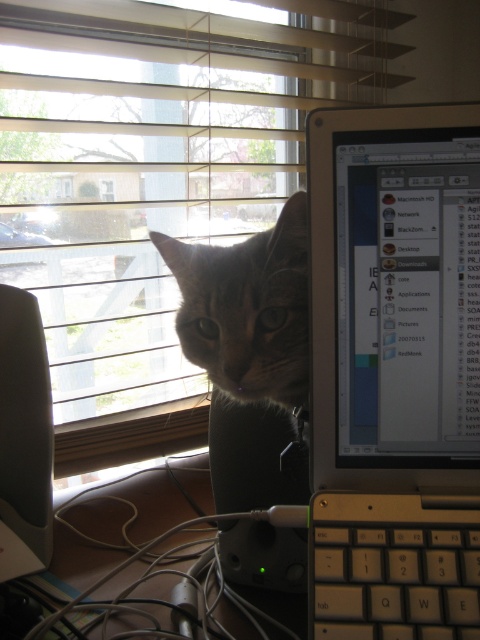
Question: Where is brown wood computer desk at lower center located in relation to transparent glass window at center in the image?

Choices:
 (A) above
 (B) below

Answer: (B)

Question: Which object is the closest to the transparent glass window at center?

Choices:
 (A) white plastic laptop at right
 (B) silver metallic keyboard at lower right
 (C) wooden blinds at upper center

Answer: (C)

Question: Among these points, which one is farthest from the camera?

Choices:
 (A) (417, 616)
 (B) (151, 634)
 (C) (3, 461)

Answer: (C)

Question: Is white plastic laptop at right to the right of transparent glass window at center from the viewer's perspective?

Choices:
 (A) no
 (B) yes

Answer: (B)

Question: Does white plastic laptop at right appear on the left side of transparent glass window at center?

Choices:
 (A) no
 (B) yes

Answer: (A)

Question: Which object appears farthest from the camera in this image?

Choices:
 (A) tabby fur cat at center
 (B) white plastic laptop at right
 (C) wooden blinds at upper center
 (D) transparent glass window at center

Answer: (D)